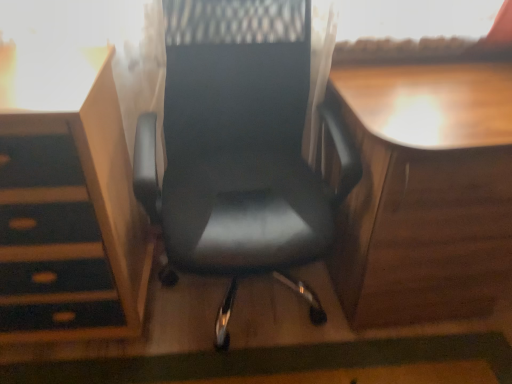
Question: Does black leather chair at center turn towards matte wood vanity at left?

Choices:
 (A) no
 (B) yes

Answer: (A)

Question: Is black leather chair at center not close to matte wood vanity at left?

Choices:
 (A) yes
 (B) no

Answer: (B)

Question: Considering the relative sizes of black leather chair at center and matte wood vanity at left in the image provided, is black leather chair at center shorter than matte wood vanity at left?

Choices:
 (A) yes
 (B) no

Answer: (B)

Question: From a real-world perspective, is black leather chair at center positioned over matte wood vanity at left based on gravity?

Choices:
 (A) no
 (B) yes

Answer: (B)

Question: From the image's perspective, does black leather chair at center appear lower than matte wood vanity at left?

Choices:
 (A) no
 (B) yes

Answer: (A)

Question: Is black leather chair at center in front of matte wood vanity at left?

Choices:
 (A) no
 (B) yes

Answer: (B)

Question: Considering the relative sizes of matte wood vanity at left and black leather chair at center in the image provided, is matte wood vanity at left bigger than black leather chair at center?

Choices:
 (A) no
 (B) yes

Answer: (A)

Question: Is matte wood vanity at left at the left side of black leather chair at center?

Choices:
 (A) no
 (B) yes

Answer: (B)

Question: Would you say matte wood vanity at left contains black leather chair at center?

Choices:
 (A) yes
 (B) no

Answer: (B)

Question: From the image's perspective, is matte wood vanity at left above black leather chair at center?

Choices:
 (A) yes
 (B) no

Answer: (B)

Question: Is the depth of matte wood vanity at left greater than that of black leather chair at center?

Choices:
 (A) yes
 (B) no

Answer: (A)

Question: Does matte wood vanity at left have a lesser width compared to black leather chair at center?

Choices:
 (A) yes
 (B) no

Answer: (A)

Question: Would you say matte wood vanity at left is part of wooden desk at right's contents?

Choices:
 (A) yes
 (B) no

Answer: (B)